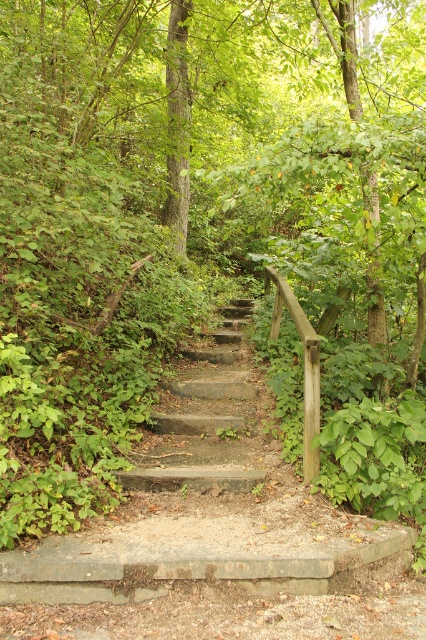
You are a delivery robot with a package that is 12 inches wide. You need to navigate up the staircase in the image. Can you safely move between the concrete steps at center and the gray concrete stairs at center?

The distance between the concrete steps at center and the gray concrete stairs at center is 11.43 inches. Since your package is 12 inches wide, it is slightly wider than the available space. Therefore, you cannot safely move between them with the package.

You are a hiker trying to find the path deeper into the woods. According to the image, where exactly are the concrete steps at center positioned?

The concrete steps at center are located at point 0.803 in the x coordinate and 0.488 in the y coordinate.